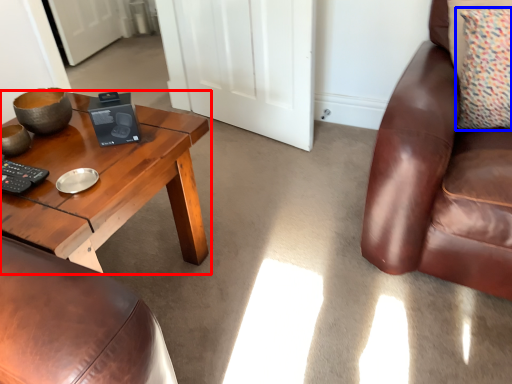
Question: Which of the following is the closest to the observer, coffee table (highlighted by a red box) or pillow (highlighted by a blue box)?

Choices:
 (A) coffee table
 (B) pillow

Answer: (A)